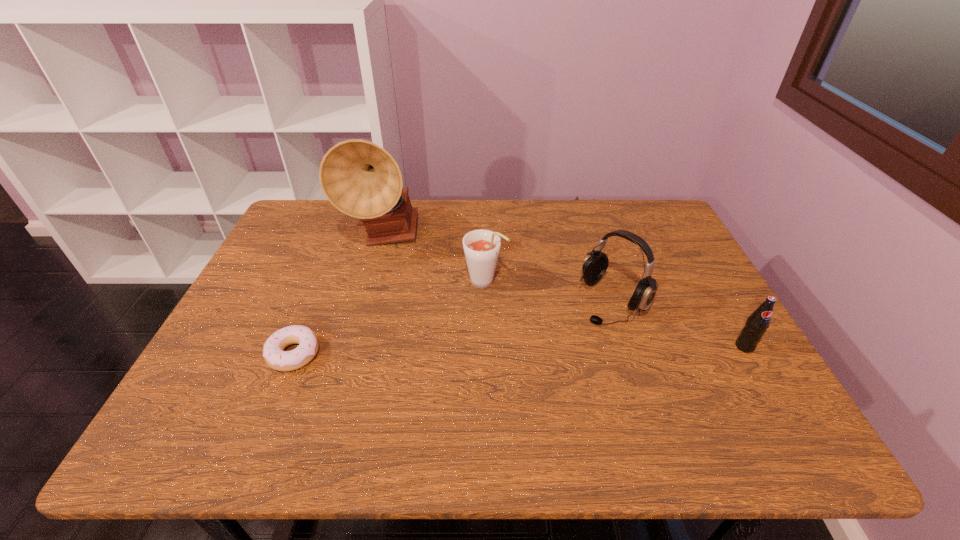
What are the coordinates of `object located at the left edge` in the screenshot? It's located at (275, 357).

Find the location of `object located in the right edge section of the desktop`. object located in the right edge section of the desktop is located at coordinates (758, 322).

Find the location of a particular element. object located at the near left corner is located at coordinates (275, 357).

In the image, there is a desktop. Where is `free space at the far edge`? The width and height of the screenshot is (960, 540). free space at the far edge is located at coordinates pos(537,202).

I want to click on vacant space at the near edge of the desktop, so click(x=315, y=378).

Find the location of `vacant space at the left edge of the desktop`. vacant space at the left edge of the desktop is located at coordinates (270, 275).

Locate an element on the screen. The image size is (960, 540). blank space at the right edge of the desktop is located at coordinates (x=732, y=330).

This screenshot has height=540, width=960. I want to click on free space at the far left corner of the desktop, so click(290, 227).

Locate an element on the screen. This screenshot has height=540, width=960. free area in between the fourth object from left to right and the rightmost object is located at coordinates (679, 323).

Locate an element on the screen. This screenshot has height=540, width=960. unoccupied area between the second object from right to left and the doughnut is located at coordinates (453, 327).